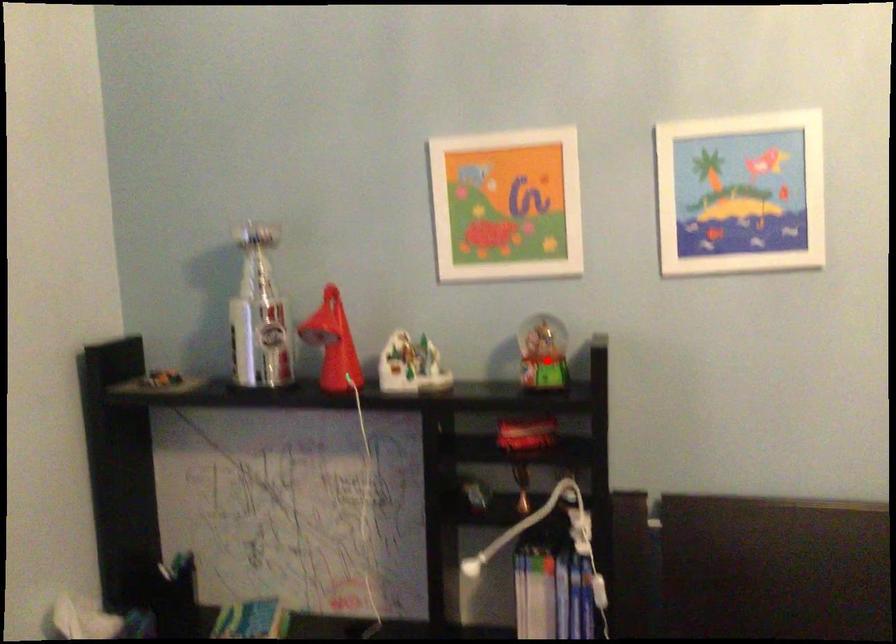
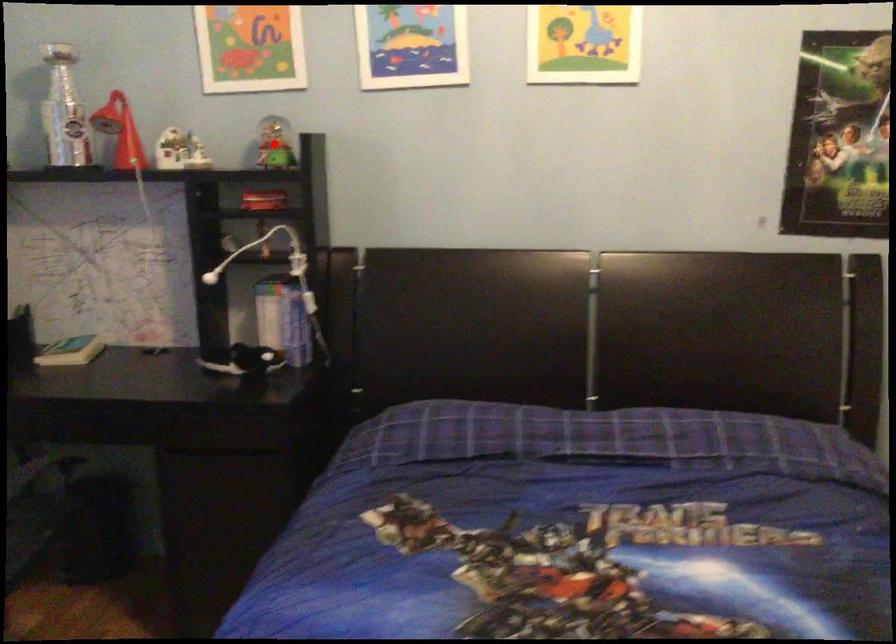
I am providing you with two images of the same scene from different viewpoints. A red point is marked on the first image and another point is marked on the second image. Do the highlighted points in image1 and image2 indicate the same real-world spot?

Yes